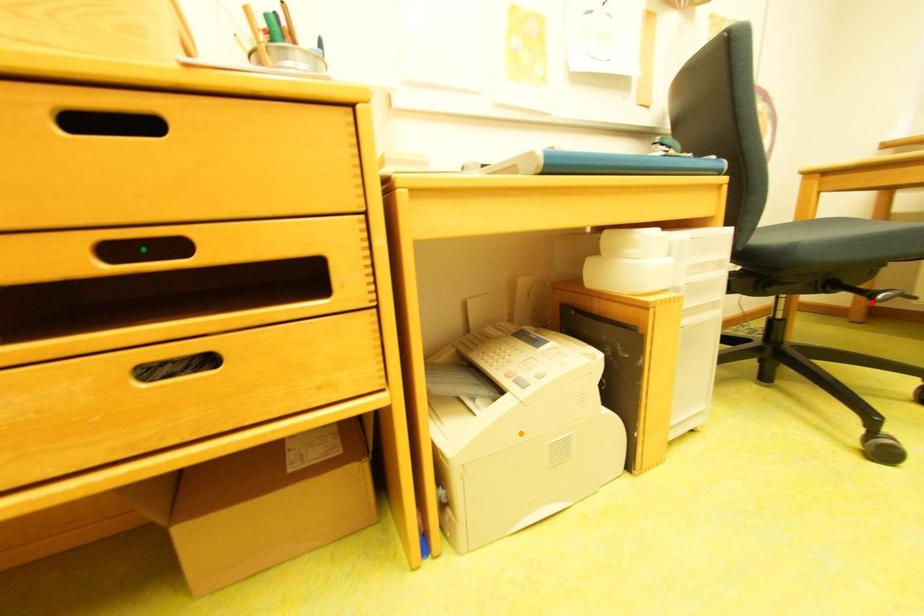
Order these from nearest to farthest:
- green point
- red point
- orange point

1. red point
2. orange point
3. green point